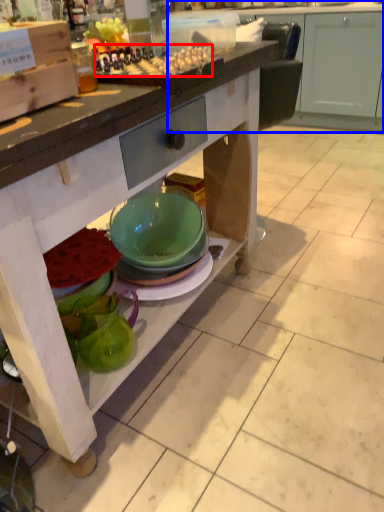
Question: Which of the following is the closest to the observer, food (highlighted by a red box) or cabinetry (highlighted by a blue box)?

Choices:
 (A) food
 (B) cabinetry

Answer: (A)